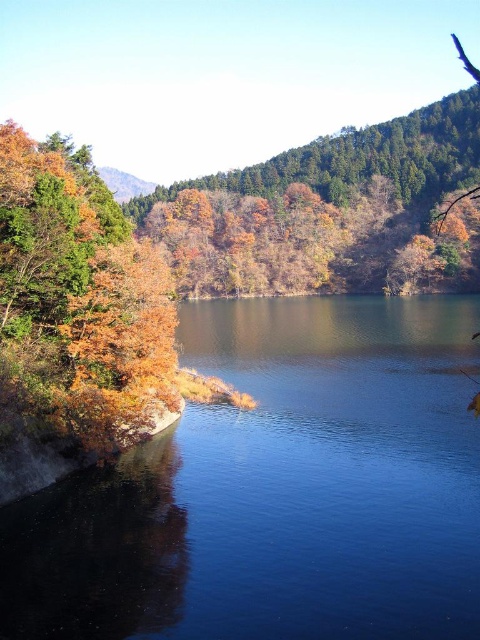
Between blue smooth water at left and autumn leaves at center, which one appears on the right side from the viewer's perspective?

autumn leaves at center is more to the right.

Who is positioned more to the left, blue smooth water at left or autumn leaves at center?

blue smooth water at left is more to the left.

At what (x,y) coordinates should I click in order to perform the action: click on blue smooth water at left. Please return your answer as a coordinate pair (x, y). This screenshot has height=640, width=480. Looking at the image, I should click on (276, 490).

Who is positioned more to the right, blue smooth water at left or autumn leaves at left?

blue smooth water at left is more to the right.

Is blue smooth water at left taller than autumn leaves at left?

No, blue smooth water at left is not taller than autumn leaves at left.

What do you see at coordinates (276, 490) in the screenshot? I see `blue smooth water at left` at bounding box center [276, 490].

The image size is (480, 640). Find the location of `blue smooth water at left`. blue smooth water at left is located at coordinates (276, 490).

Consider the image. Does autumn leaves at center have a greater width compared to autumn leaves at left?

Correct, the width of autumn leaves at center exceeds that of autumn leaves at left.

Is autumn leaves at center to the left of autumn leaves at left from the viewer's perspective?

Incorrect, autumn leaves at center is not on the left side of autumn leaves at left.

Where is `autumn leaves at center`? autumn leaves at center is located at coordinates (332, 212).